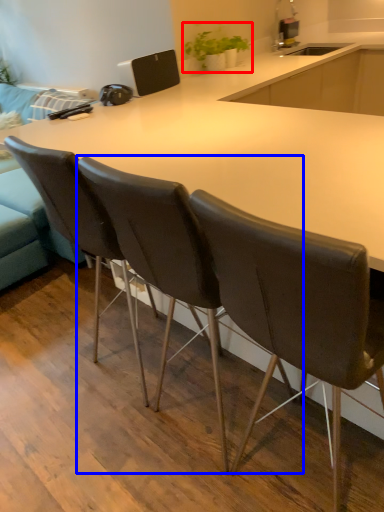
Question: Which object is closer to the camera taking this photo, houseplant (highlighted by a red box) or chair (highlighted by a blue box)?

Choices:
 (A) houseplant
 (B) chair

Answer: (B)